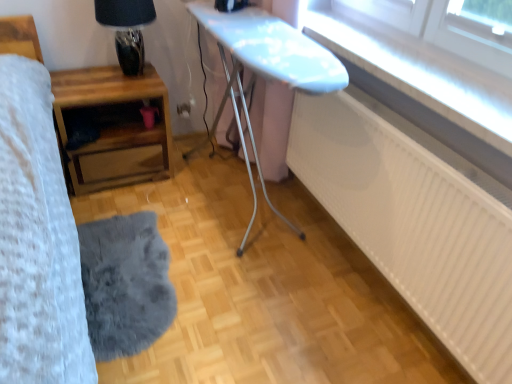
Question: Is point (135, 21) positioned closer to the camera than point (275, 18)?

Choices:
 (A) closer
 (B) farther

Answer: (A)

Question: From the image's perspective, is matte glass table lamp at upper left positioned above or below white glossy ironing board at center, which appears as the first table when viewed from the right?

Choices:
 (A) below
 (B) above

Answer: (B)

Question: Considering the real-world distances, which object is farthest from the white glossy ironing board at center, the second table viewed from the left?

Choices:
 (A) transparent glass window at upper right
 (B) gray fluffy mat at lower left
 (C) wooden nightstand at left, which appears as the first table when viewed from the left
 (D) matte glass table lamp at upper left
 (E) white matte radiator at lower right

Answer: (B)

Question: Estimate the real-world distances between objects in this image. Which object is farther from the wooden nightstand at left, which ranks as the second table in right-to-left order?

Choices:
 (A) transparent glass window at upper right
 (B) gray fluffy mat at lower left
 (C) white matte radiator at lower right
 (D) white glossy ironing board at center, which appears as the first table when viewed from the right
 (E) matte glass table lamp at upper left

Answer: (A)